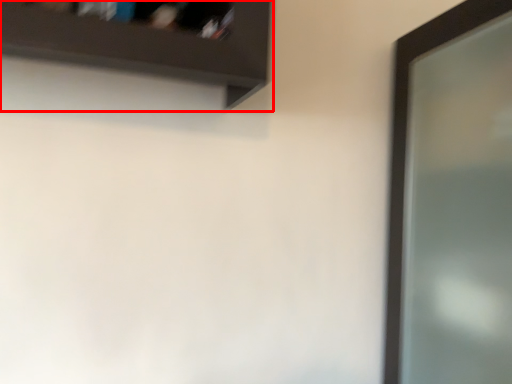
Question: From the image, what is the correct spatial relationship of shelf (annotated by the red box) in relation to screen door?

Choices:
 (A) left
 (B) right

Answer: (A)